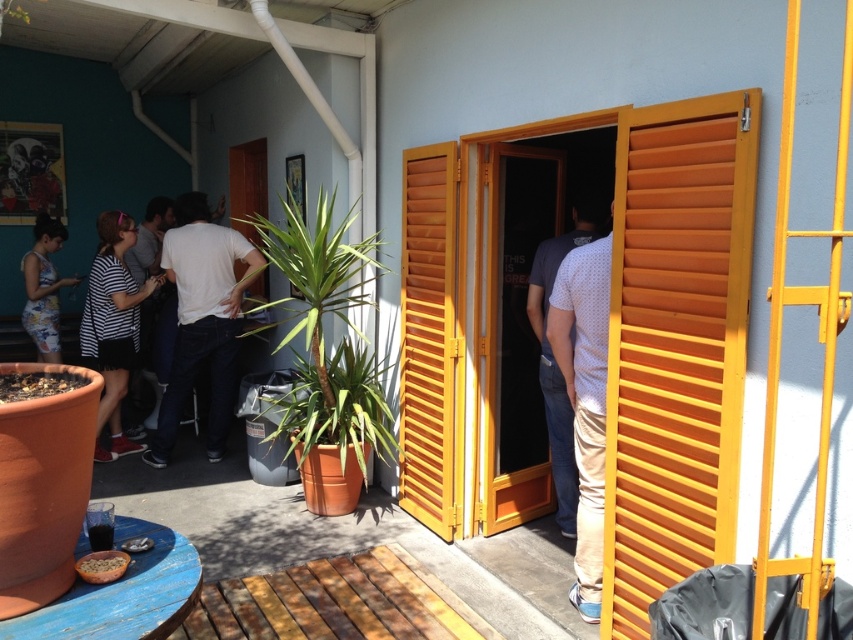
Question: Is yellow wooden shutter at right below floral dress at left?

Choices:
 (A) no
 (B) yes

Answer: (B)

Question: Is striped cotton shirt at left closer to the viewer compared to white dotted shirt at center?

Choices:
 (A) yes
 (B) no

Answer: (B)

Question: Which point is closer to the camera?

Choices:
 (A) (123, 381)
 (B) (660, 486)

Answer: (B)

Question: Is the position of wooden door at center less distant than that of white matte shirt at center?

Choices:
 (A) no
 (B) yes

Answer: (B)

Question: Among these points, which one is farthest from the camera?

Choices:
 (A) (413, 364)
 (B) (718, 552)
 (C) (531, 307)

Answer: (A)

Question: Which point is closer to the camera?

Choices:
 (A) striped fabric shirt at left
 (B) wooden at right

Answer: (B)